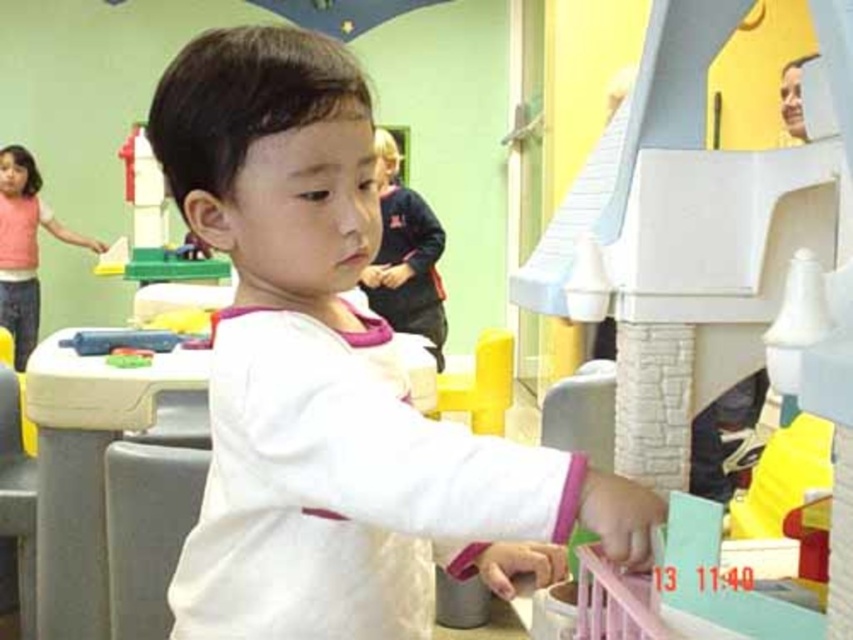
Is white matte shirt at center shorter than pink fabric shirt at upper left?

Correct, white matte shirt at center is not as tall as pink fabric shirt at upper left.

Between white matte shirt at center and pink fabric shirt at upper left, which one appears on the right side from the viewer's perspective?

Positioned to the right is white matte shirt at center.

Describe the element at coordinates (334, 380) in the screenshot. I see `white matte shirt at center` at that location.

At what (x,y) coordinates should I click in order to perform the action: click on white matte shirt at center. Please return your answer as a coordinate pair (x, y). The width and height of the screenshot is (853, 640). Looking at the image, I should click on (334, 380).